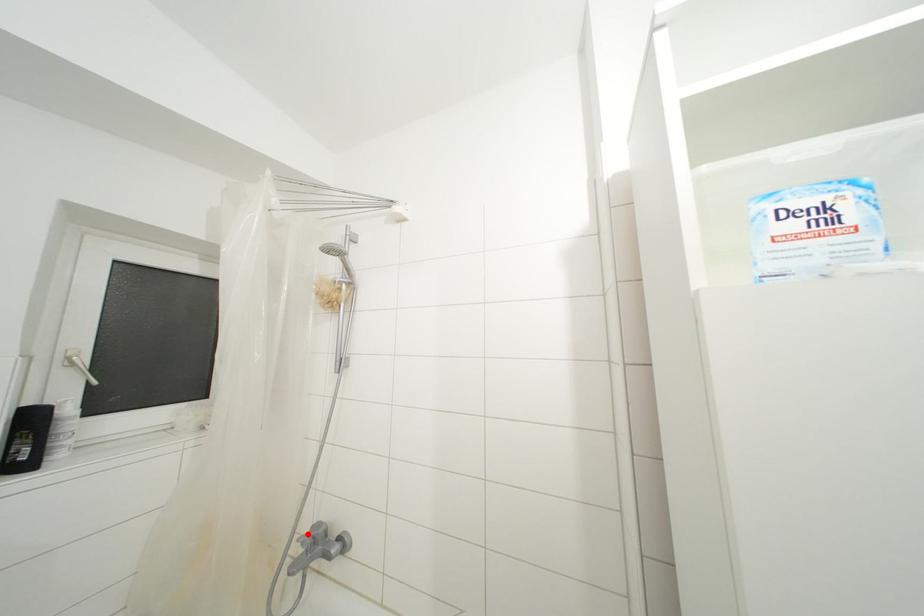
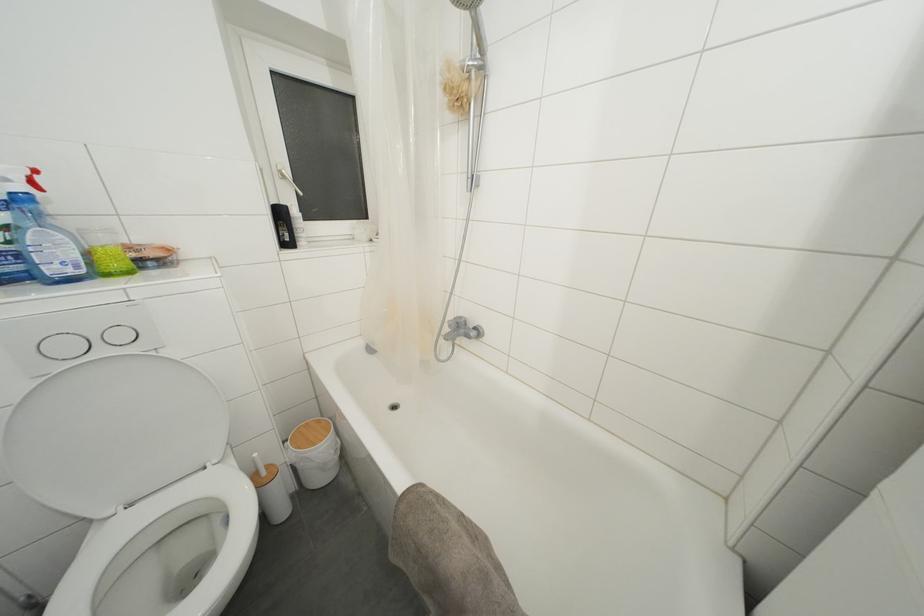
Locate, in the second image, the point that corresponds to the highlighted location in the first image.

(455, 321)